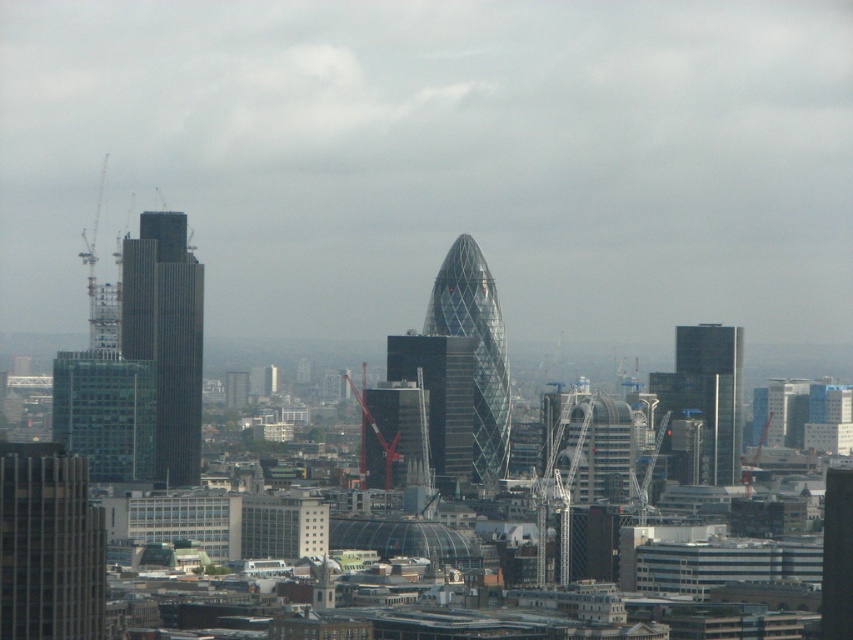
You are standing in the city looking at the Gherkin building. There are two points marked in the image, one at coordinates point (465, 444) and the other at point (398, 477). Which point is closer to your viewpoint?

The point at coordinates point (465, 444) is closer to your viewpoint than the point at point (398, 477).